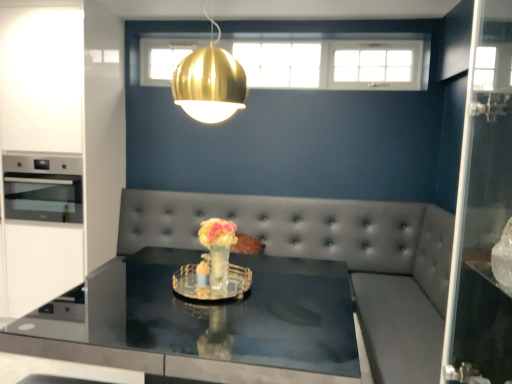
Where is `free spot to the right of translucent glass vase at center`? This screenshot has height=384, width=512. free spot to the right of translucent glass vase at center is located at coordinates (267, 295).